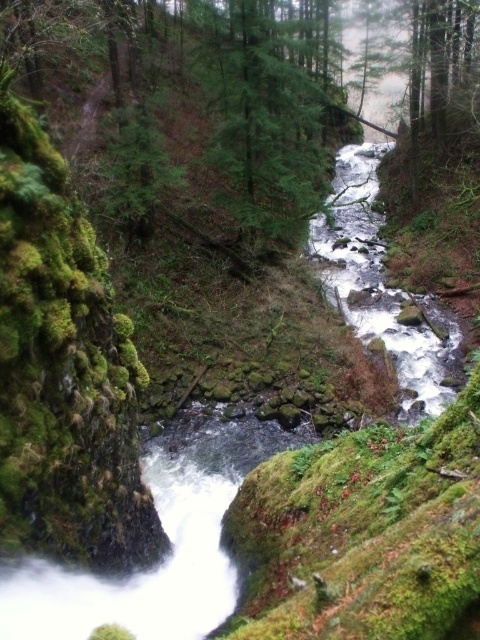
Is point (268, 227) positioned before point (429, 404)?

No, (268, 227) is behind (429, 404).

Is green mossy tree at center bigger than white frothy water at center?

Indeed, green mossy tree at center has a larger size compared to white frothy water at center.

You are a GUI agent. You are given a task and a screenshot of the screen. Output one action in this format:
    pyautogui.click(x=<x>, y=<y>)
    Task: Click on the green mossy tree at center
    
    Given the screenshot: What is the action you would take?
    pyautogui.click(x=240, y=112)

At what (x,y) coordinates should I click in order to perform the action: click on green mossy tree at center. Please return your answer as a coordinate pair (x, y). Image resolution: width=480 pixels, height=640 pixels. Looking at the image, I should click on (240, 112).